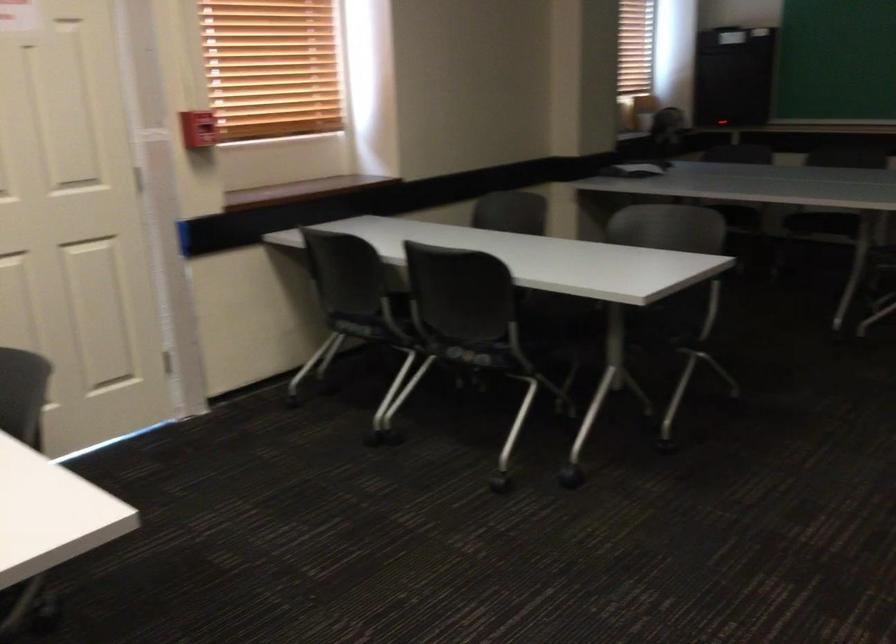
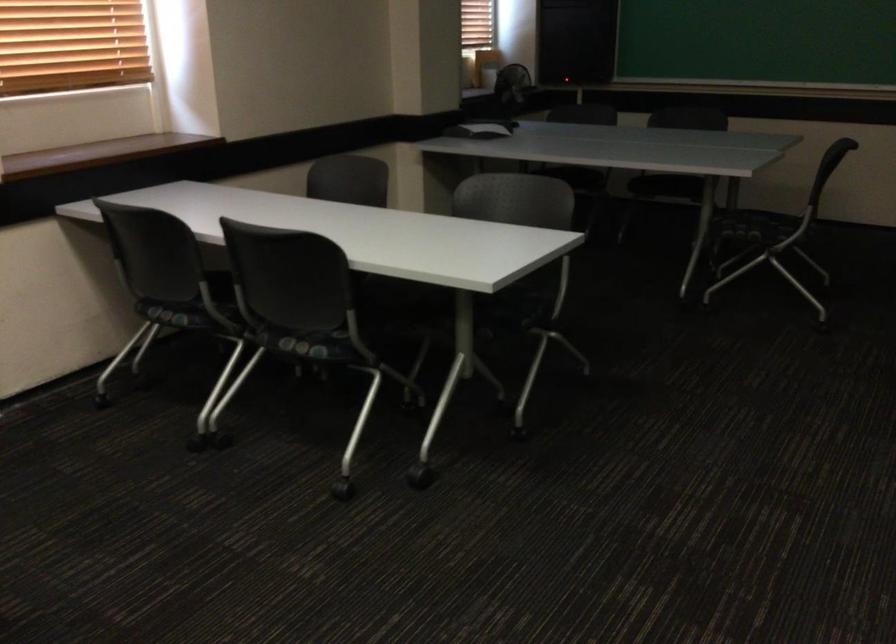
Question: The images are taken continuously from a first-person perspective. In which direction is your viewpoint rotating?

Choices:
 (A) Left
 (B) Right
 (C) Up
 (D) Down

Answer: (B)